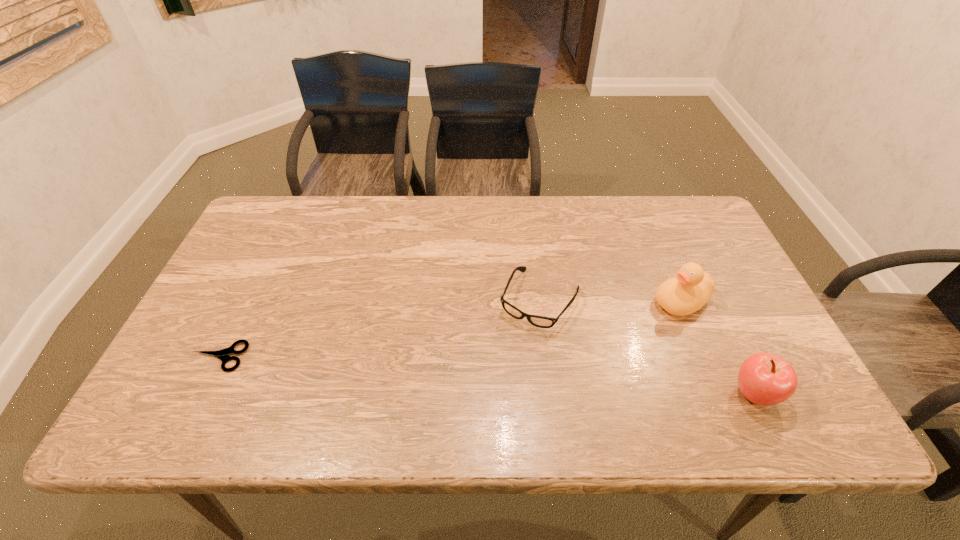
Identify the location of object present at the near right corner. [765, 379].

The height and width of the screenshot is (540, 960). In the image, there is a desktop. In order to click on blank space at the far edge in this screenshot , I will do `click(361, 213)`.

In the image, there is a desktop. Identify the location of vacant space at the near edge. This screenshot has width=960, height=540. (669, 369).

Locate an element on the screen. The image size is (960, 540). free space at the left edge of the desktop is located at coordinates point(240,346).

In the image, there is a desktop. Where is `free space at the far left corner`? The width and height of the screenshot is (960, 540). free space at the far left corner is located at coordinates (272, 218).

Where is `blank space at the near left corner`? The image size is (960, 540). blank space at the near left corner is located at coordinates (184, 373).

In the image, there is a desktop. Identify the location of blank space at the far right corner. (667, 214).

Find the location of a particular element. This screenshot has height=540, width=960. free spot between the third farthest object and the third object from right to left is located at coordinates pyautogui.click(x=379, y=328).

At what (x,y) coordinates should I click in order to perform the action: click on blank region between the duck and the third tallest object. Please return your answer as a coordinate pair (x, y). This screenshot has width=960, height=540. Looking at the image, I should click on coord(611,301).

In order to click on free spot between the second shortest object and the nearest object in this screenshot , I will do `click(647, 347)`.